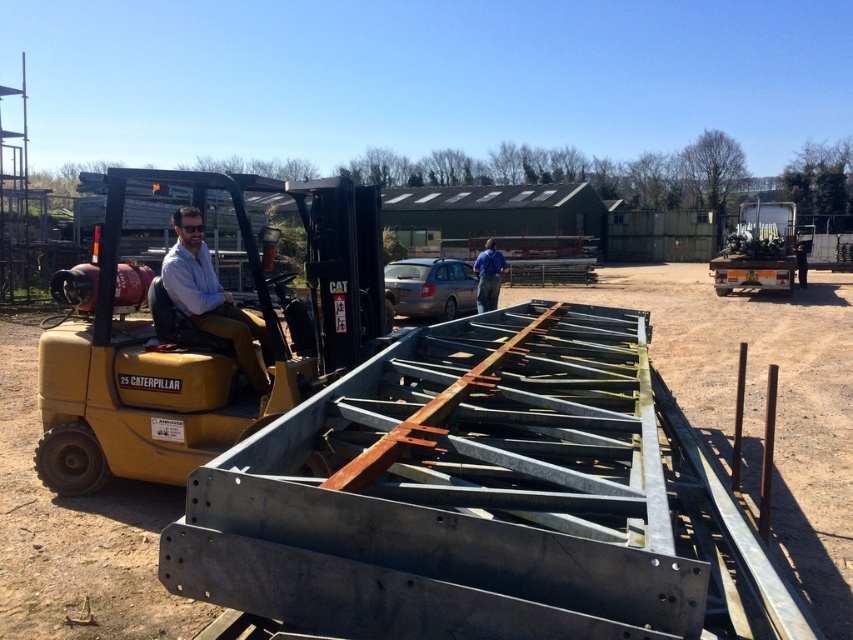
Who is positioned more to the right, matte yellow forklift at center or blue fabric shirt at center?

Positioned to the right is blue fabric shirt at center.

Is matte yellow forklift at center to the left of blue fabric shirt at center from the viewer's perspective?

Indeed, matte yellow forklift at center is positioned on the left side of blue fabric shirt at center.

The width and height of the screenshot is (853, 640). In order to click on matte yellow forklift at center in this screenshot , I will do `click(212, 298)`.

What are the coordinates of `matte yellow forklift at center` in the screenshot? It's located at (212, 298).

Who is higher up, metal frame at center or blue fabric shirt at center?

metal frame at center is above.

Based on the photo, between metal frame at center and blue fabric shirt at center, which one appears on the right side from the viewer's perspective?

metal frame at center is more to the right.

I want to click on metal frame at center, so click(x=13, y=602).

Does matte yellow forklift at center appear over metallic silver tractor at right?

Incorrect, matte yellow forklift at center is not positioned above metallic silver tractor at right.

Who is taller, matte yellow forklift at center or metallic silver tractor at right?

metallic silver tractor at right

Consider the image. Measure the distance between matte yellow forklift at center and camera.

A distance of 16.11 feet exists between matte yellow forklift at center and camera.

The image size is (853, 640). I want to click on matte yellow forklift at center, so click(212, 298).